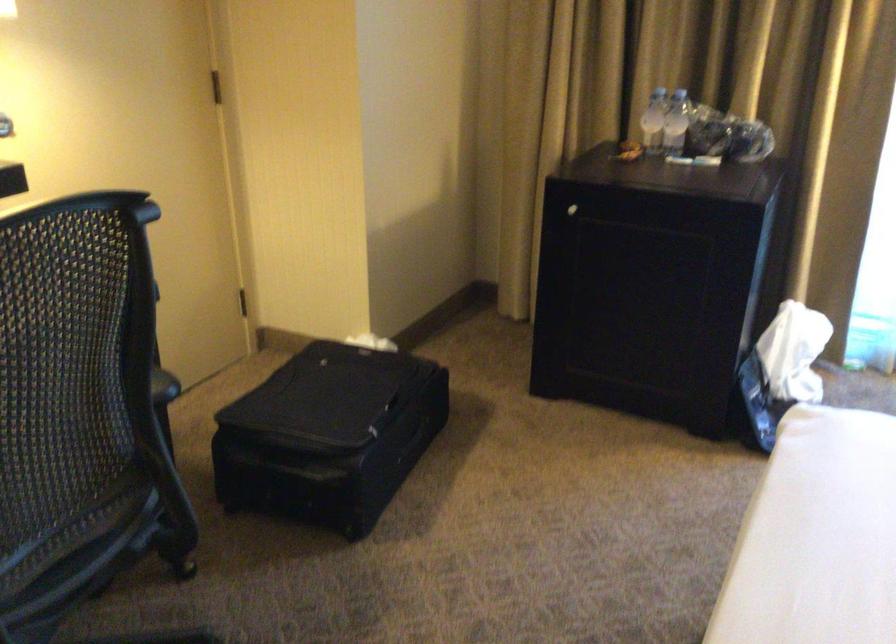
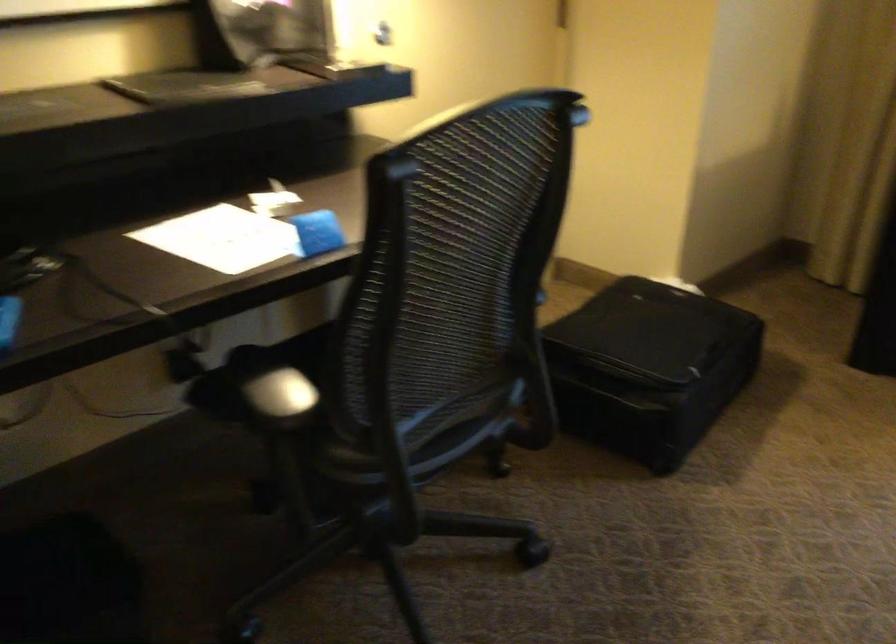
Find the pixel in the second image that matches pixel 326 437 in the first image.

(649, 366)